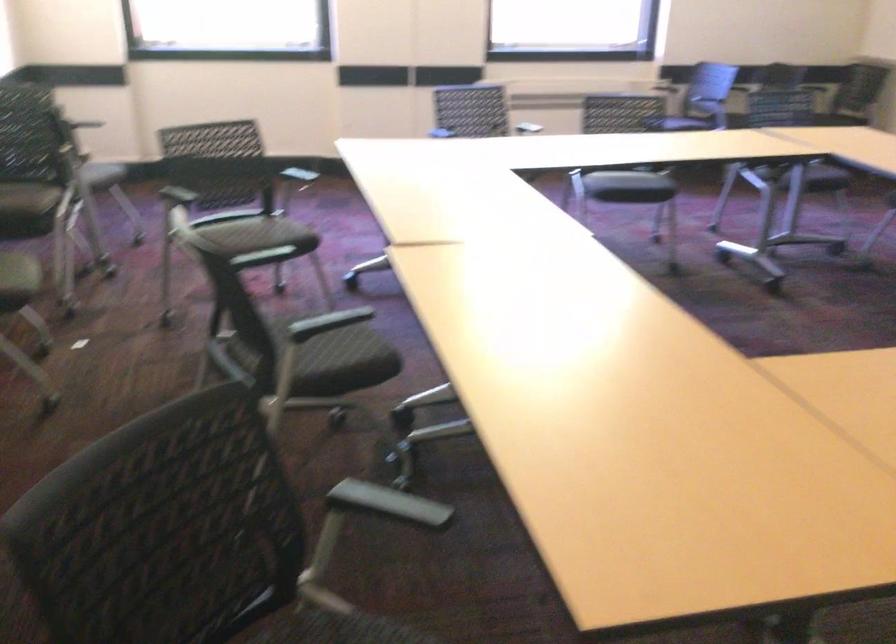
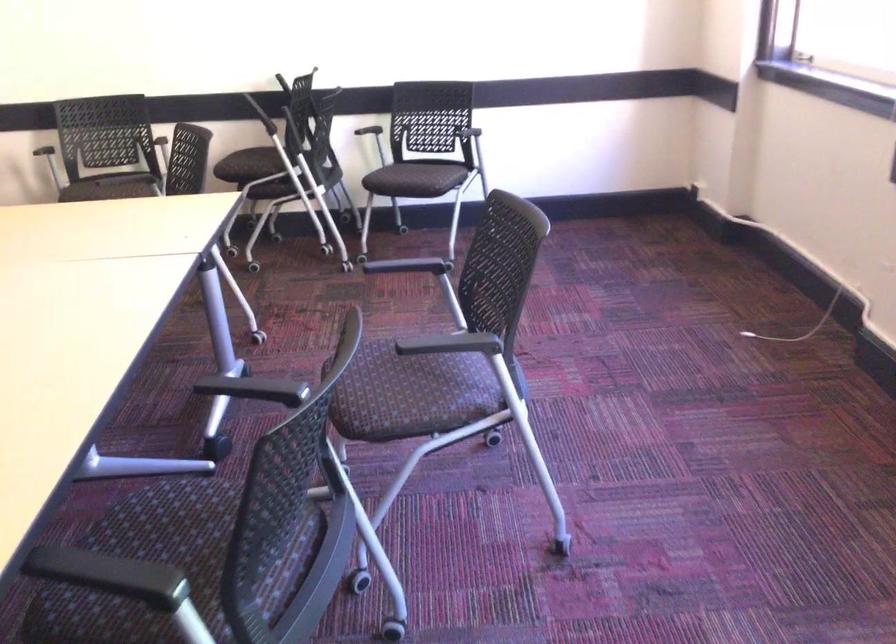
In the second image, find the point that corresponds to (113,172) in the first image.

(415, 178)